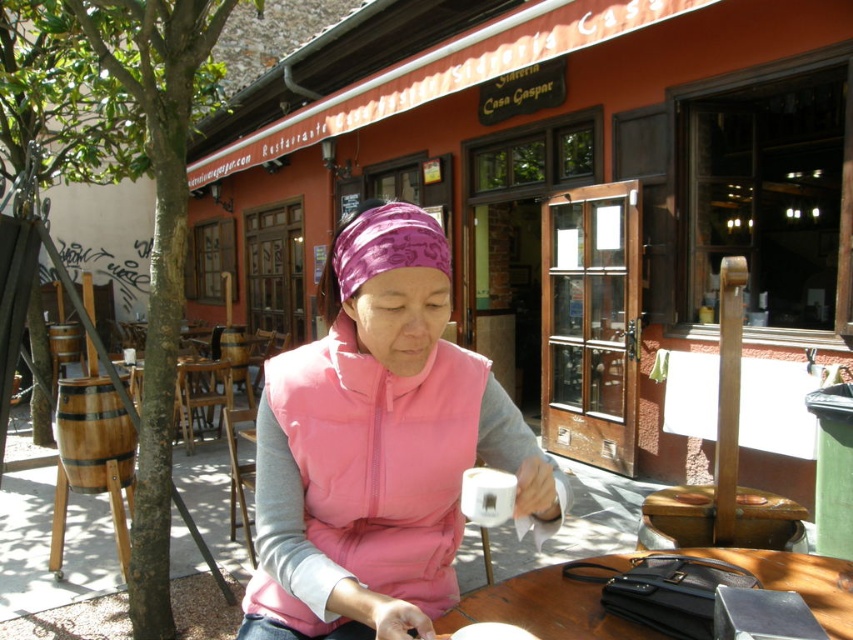
Does pink matte vest at center have a larger size compared to wooden table at center?

Yes, pink matte vest at center is bigger than wooden table at center.

Who is more forward, (x=393, y=579) or (x=550, y=632)?

Point (x=550, y=632) is in front.

Who is more distant from viewer, [392,307] or [553,632]?

Point [553,632]

Where is `pink matte vest at center`? This screenshot has height=640, width=853. pink matte vest at center is located at coordinates (379, 445).